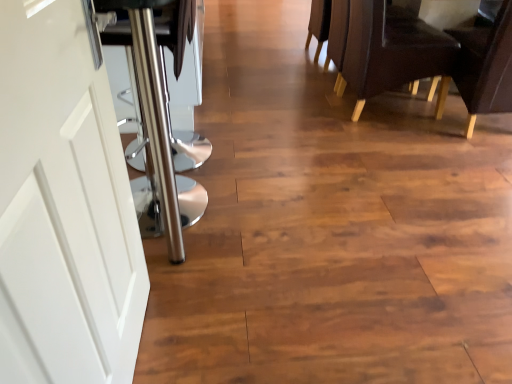
Question: Does leather-like dark brown chair at right, which is the 2th chair from right to left, come behind brown leather chair at upper right, the 2th chair when ordered from left to right?

Choices:
 (A) yes
 (B) no

Answer: (A)

Question: From the image's perspective, is leather-like dark brown chair at right, the 1th chair from the left, above brown leather chair at upper right, the 2th chair when ordered from left to right?

Choices:
 (A) yes
 (B) no

Answer: (A)

Question: Can you confirm if leather-like dark brown chair at right, the 1th chair from the left, is positioned to the left of brown leather chair at upper right, marked as the 1th chair in a right-to-left arrangement?

Choices:
 (A) no
 (B) yes

Answer: (B)

Question: Does leather-like dark brown chair at right, which is the 2th chair from right to left, appear on the right side of brown leather chair at upper right, marked as the 1th chair in a right-to-left arrangement?

Choices:
 (A) yes
 (B) no

Answer: (B)

Question: Is leather-like dark brown chair at right, the 1th chair from the left, taller than brown leather chair at upper right, the 2th chair when ordered from left to right?

Choices:
 (A) yes
 (B) no

Answer: (B)

Question: Visually, is white matte door at left positioned to the left or to the right of leather-like dark brown chair at right, which is the 2th chair from right to left?

Choices:
 (A) right
 (B) left

Answer: (B)

Question: From the image's perspective, is white matte door at left above or below leather-like dark brown chair at right, the 1th chair from the left?

Choices:
 (A) below
 (B) above

Answer: (A)

Question: Does point (2, 380) appear closer or farther from the camera than point (418, 72)?

Choices:
 (A) closer
 (B) farther

Answer: (A)

Question: From a real-world perspective, is white matte door at left physically located above or below leather-like dark brown chair at right, the 1th chair from the left?

Choices:
 (A) below
 (B) above

Answer: (B)

Question: In terms of height, does brown leather chair at upper right, the 2th chair when ordered from left to right, look taller or shorter compared to leather-like dark brown chair at right, the 1th chair from the left?

Choices:
 (A) short
 (B) tall

Answer: (B)

Question: Is brown leather chair at upper right, marked as the 1th chair in a right-to-left arrangement, to the left or to the right of leather-like dark brown chair at right, the 1th chair from the left, in the image?

Choices:
 (A) right
 (B) left

Answer: (A)

Question: Is brown leather chair at upper right, the 2th chair when ordered from left to right, inside or outside of leather-like dark brown chair at right, which is the 2th chair from right to left?

Choices:
 (A) outside
 (B) inside

Answer: (A)

Question: From a real-world perspective, is brown leather chair at upper right, the 2th chair when ordered from left to right, above or below leather-like dark brown chair at right, the 1th chair from the left?

Choices:
 (A) above
 (B) below

Answer: (A)

Question: Is white matte door at left in front of or behind brown leather chair at upper right, marked as the 1th chair in a right-to-left arrangement, in the image?

Choices:
 (A) front
 (B) behind

Answer: (A)

Question: In terms of width, does white matte door at left look wider or thinner when compared to brown leather chair at upper right, the 2th chair when ordered from left to right?

Choices:
 (A) thin
 (B) wide

Answer: (A)